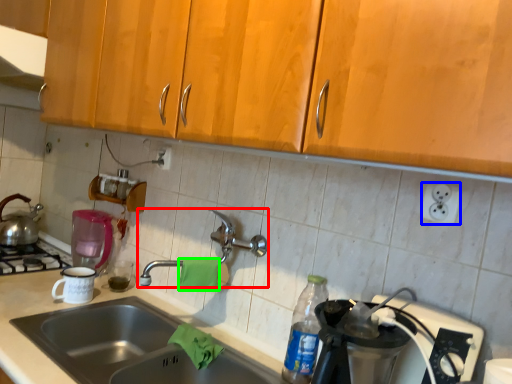
Question: Considering the real-world distances, which object is farthest from tap (highlighted by a red box)? electric outlet (highlighted by a blue box) or material (highlighted by a green box)?

Choices:
 (A) electric outlet
 (B) material

Answer: (A)